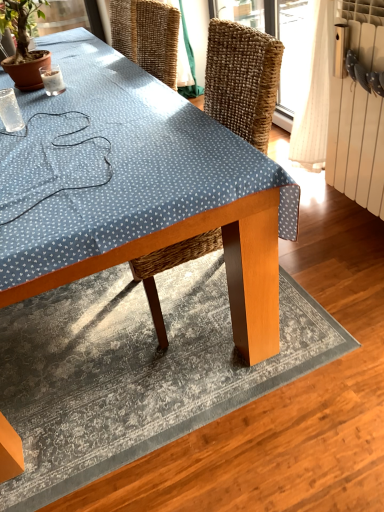
Image resolution: width=384 pixels, height=512 pixels. What are the coordinates of `vacant point to the left of wooden table at center` in the screenshot? It's located at (86, 349).